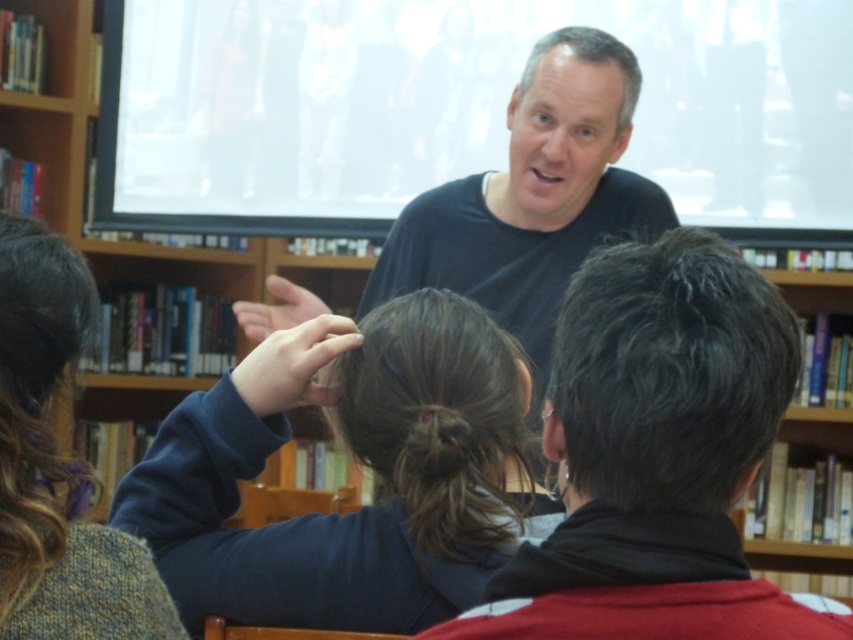
Can you confirm if black matte shirt at center is bigger than knitted sweater at lower left?

Yes.

Which is more to the left, black matte shirt at center or knitted sweater at lower left?

Positioned to the left is knitted sweater at lower left.

Based on the photo, who is more forward, (637, 236) or (22, 316)?

Positioned in front is point (22, 316).

Locate an element on the screen. This screenshot has width=853, height=640. black matte shirt at center is located at coordinates [x=532, y=196].

Locate an element on the screen. knitted sweater at lower left is located at coordinates (56, 465).

Who is lower down, knitted sweater at lower left or brown fuzzy hair at center?

brown fuzzy hair at center

Does point (68, 467) come in front of point (418, 413)?

Yes.

Image resolution: width=853 pixels, height=640 pixels. I want to click on knitted sweater at lower left, so click(x=56, y=465).

Who is positioned more to the left, black matte shirt at center or blonde curly hair at upper left?

From the viewer's perspective, blonde curly hair at upper left appears more on the left side.

Is point (553, 104) behind point (74, 483)?

Yes, it is behind point (74, 483).

This screenshot has height=640, width=853. Identify the location of black matte shirt at center. tap(532, 196).